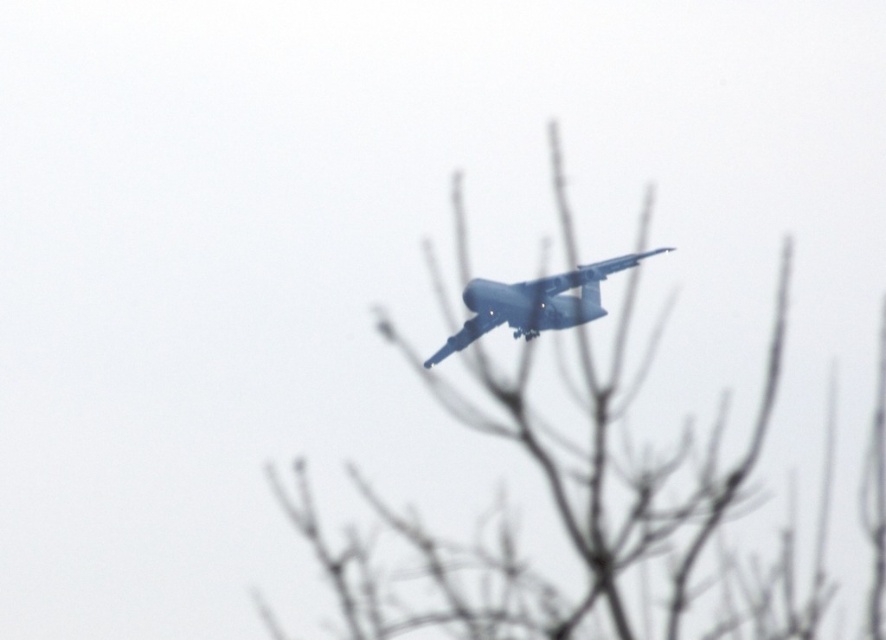
Based on the photo, which of these two, bare branches at center or matte blue airplane at center, stands shorter?

matte blue airplane at center

This screenshot has height=640, width=886. What do you see at coordinates (578, 497) in the screenshot? I see `bare branches at center` at bounding box center [578, 497].

Find the location of a particular element. bare branches at center is located at coordinates (578, 497).